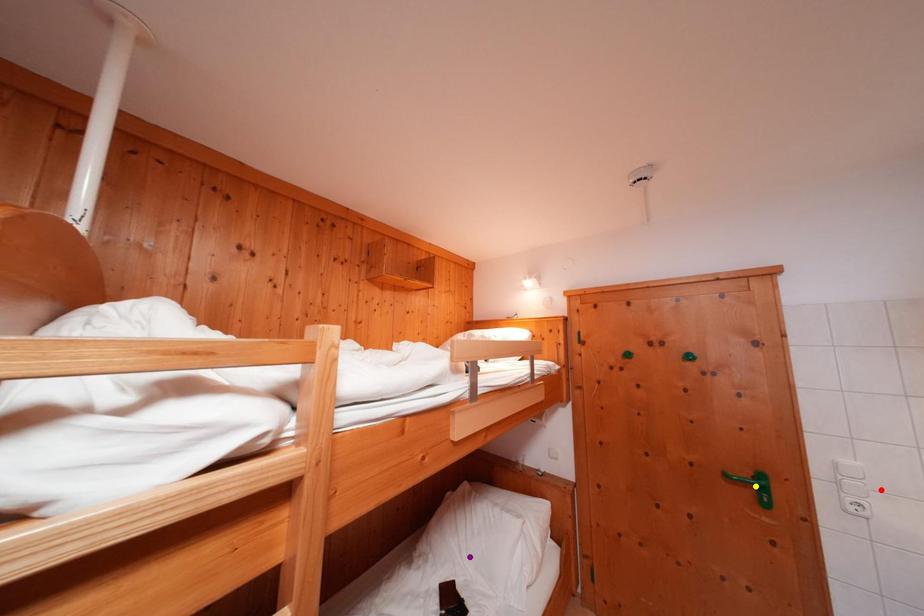
Order these from nearest to farthest:
A) red point
B) purple point
C) yellow point

red point → yellow point → purple point